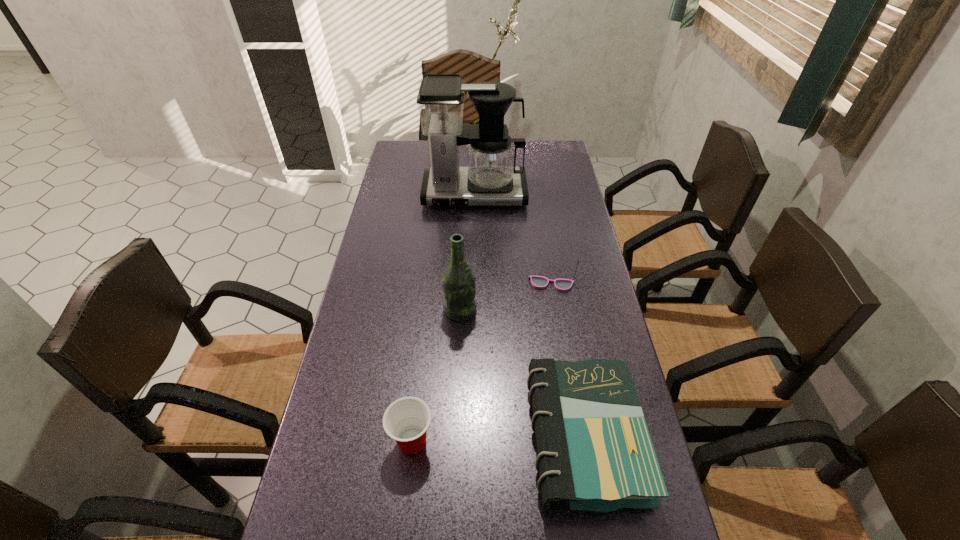
Locate an element on the screen. vacant area located 0.050m on the left of the cup is located at coordinates (368, 441).

At what (x,y) coordinates should I click in order to perform the action: click on vacant region located 0.170m on the back of the paperback book. Please return your answer as a coordinate pair (x, y). This screenshot has width=960, height=540. Looking at the image, I should click on (564, 325).

This screenshot has width=960, height=540. In order to click on object located at the left edge in this screenshot , I will do `click(490, 178)`.

Image resolution: width=960 pixels, height=540 pixels. I want to click on spectacles present at the right edge, so click(539, 282).

Locate an element on the screen. The width and height of the screenshot is (960, 540). paperback book located at the right edge is located at coordinates (595, 453).

In order to click on vacant region at the left edge of the desktop in this screenshot , I will do `click(357, 292)`.

This screenshot has width=960, height=540. I want to click on vacant region at the right edge, so click(x=550, y=260).

At what (x,y) coordinates should I click in order to perform the action: click on vacant space at the far right corner. Please return your answer as a coordinate pair (x, y). The height and width of the screenshot is (540, 960). Looking at the image, I should click on (559, 167).

The width and height of the screenshot is (960, 540). Find the location of `free space between the beer bottle and the cup`. free space between the beer bottle and the cup is located at coordinates (436, 375).

Locate an element on the screen. This screenshot has width=960, height=540. free space between the coffee maker and the paperback book is located at coordinates (529, 317).